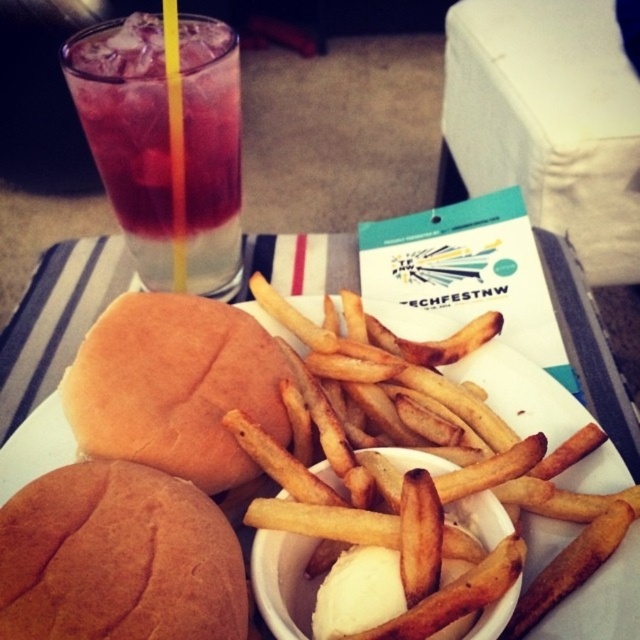
Question: Is brown matte bun at lower left to the right of brown soft bun at center from the viewer's perspective?

Choices:
 (A) yes
 (B) no

Answer: (B)

Question: Which of these objects is positioned farthest from the golden crispy french fries at center?

Choices:
 (A) brown soft bun at center
 (B) brown matte bun at lower left

Answer: (B)

Question: Does brown matte bun at lower left appear on the right side of golden crispy french fries at center?

Choices:
 (A) no
 (B) yes

Answer: (A)

Question: Among these objects, which one is nearest to the camera?

Choices:
 (A) brown soft bun at center
 (B) golden crispy french fries at center

Answer: (B)

Question: Can you confirm if brown soft bun at center is smaller than golden crispy french fries at center?

Choices:
 (A) yes
 (B) no

Answer: (A)

Question: Which object is positioned farthest from the golden crispy french fries at center?

Choices:
 (A) translucent glass at upper left
 (B) brown soft bun at center
 (C) brown matte bun at lower left

Answer: (A)